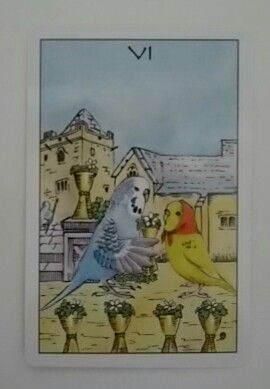
Find the location of a particular element. The image size is (270, 389). wall is located at coordinates (260, 60).